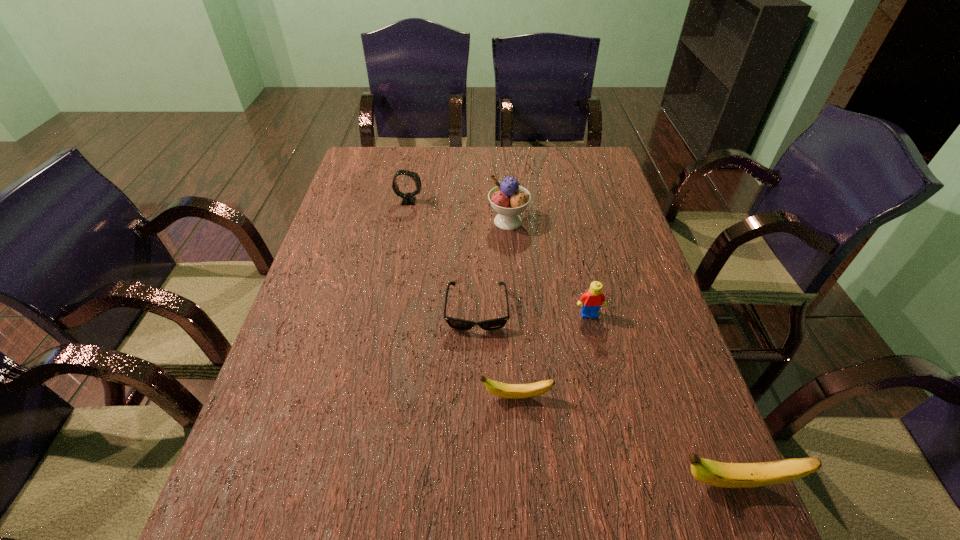
You are a GUI agent. You are given a task and a screenshot of the screen. Output one action in this format:
    pyautogui.click(x=<x>, y=<y>)
    Task: Click on the free location located at the stem of the second nearest object
    The height and width of the screenshot is (540, 960).
    Given the screenshot: What is the action you would take?
    [x=422, y=397]

Locate an element on the screen. free spot located at the stem of the second nearest object is located at coordinates (289, 397).

You are a GUI agent. You are given a task and a screenshot of the screen. Output one action in this format:
    pyautogui.click(x=<x>, y=<y>)
    Task: Click on the vacant space located at the stem of the second nearest object
    
    Given the screenshot: What is the action you would take?
    pyautogui.click(x=370, y=397)

This screenshot has height=540, width=960. What are the coordinates of `vacant space located 0.150m at the stem of the taller banana` in the screenshot? It's located at (588, 483).

The image size is (960, 540). Find the location of `free space located 0.320m at the stem of the taller banana`. free space located 0.320m at the stem of the taller banana is located at coordinates (494, 483).

This screenshot has height=540, width=960. Identify the location of vacant space located at the stem of the taller banana. (550, 483).

Locate an element on the screen. The width and height of the screenshot is (960, 540). free location located 0.100m on the left of the tallest object is located at coordinates (455, 221).

Identify the location of vacant space situated on the face of the farthest object. click(x=532, y=201).

I want to click on vacant position located 0.220m on the face of the Lego, so click(x=609, y=401).

Find the location of a particular element. This screenshot has height=540, width=960. free space located 0.070m on the front-facing side of the shortest object is located at coordinates (476, 360).